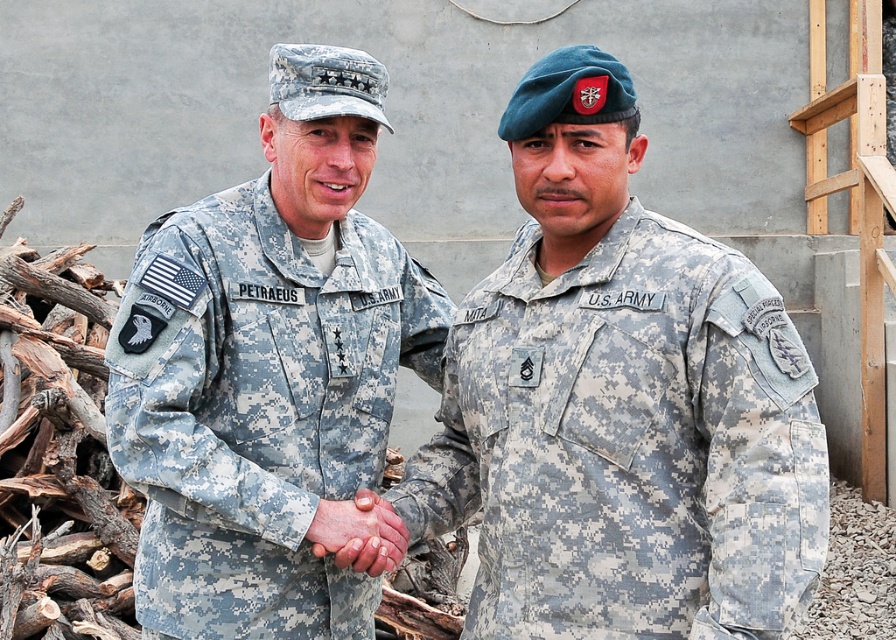
Question: Which object appears farthest from the camera in this image?

Choices:
 (A) camouflage fabric uniform at left
 (B) camouflage fabric us army uniform at center

Answer: (A)

Question: Which of the following is the closest to the observer?

Choices:
 (A) camouflage fabric us army uniform at center
 (B) camouflage fabric uniform at left

Answer: (A)

Question: Does camouflage fabric us army uniform at center appear on the right side of camouflage fabric uniform at left?

Choices:
 (A) no
 (B) yes

Answer: (B)

Question: In this image, where is camouflage fabric us army uniform at center located relative to camouflage fabric uniform at left?

Choices:
 (A) below
 (B) above

Answer: (A)

Question: Is camouflage fabric us army uniform at center in front of camouflage fabric uniform at left?

Choices:
 (A) no
 (B) yes

Answer: (B)